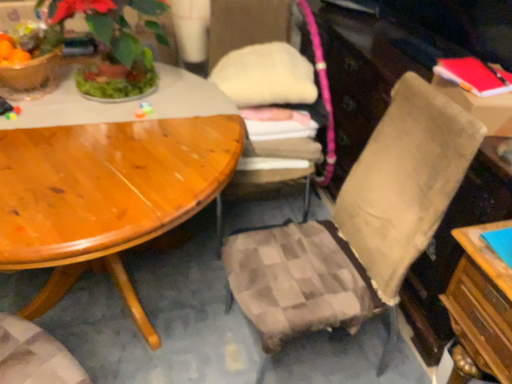
Question: Is red matte book at upper right to the left or to the right of green leafy plant at upper left in the image?

Choices:
 (A) left
 (B) right

Answer: (B)

Question: From the image's perspective, is red matte book at upper right located above or below green leafy plant at upper left?

Choices:
 (A) below
 (B) above

Answer: (A)

Question: Estimate the real-world distances between objects in this image. Which object is farther from the green leafy plant at upper left?

Choices:
 (A) plaid fabric chair at center, the 2th chair from the right
 (B) beige fabric chair at center, acting as the second chair starting from the left
 (C) red matte book at upper right
 (D) matte plastic flowerpot at upper left
 (E) red matte book at upper right

Answer: (C)

Question: Which object is positioned closest to the plaid fabric chair at center, which ranks as the first chair in left-to-right order?

Choices:
 (A) green leafy plant at upper left
 (B) beige fabric chair at center, the first chair viewed from the right
 (C) matte plastic flowerpot at upper left
 (D) red matte book at upper right
 (E) red matte book at upper right

Answer: (A)